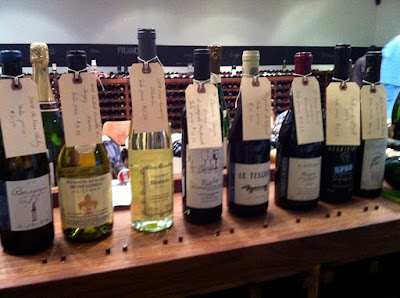
The image size is (400, 298). In order to click on black border going across wall in this screenshot , I will do `click(24, 47)`, `click(102, 49)`, `click(125, 59)`, `click(168, 52)`, `click(271, 52)`, `click(323, 51)`, `click(357, 51)`.